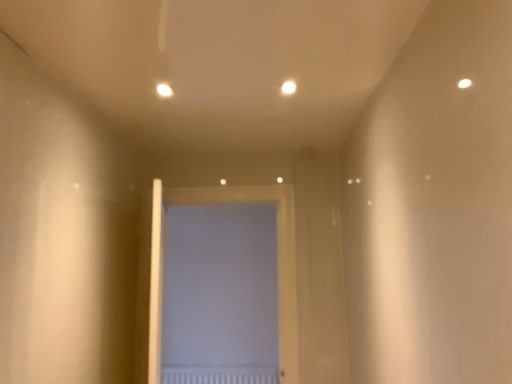
Question: Should I look upward or downward to see matte white light at upper center, acting as the first light starting from the left?

Choices:
 (A) up
 (B) down

Answer: (A)

Question: Which direction should I rotate to look at white glossy light at upper center, acting as the 2th light starting from the left?

Choices:
 (A) right
 (B) left

Answer: (A)

Question: Can you confirm if matte white light at upper center, acting as the first light starting from the left, is smaller than white glossy light at upper center, acting as the 2th light starting from the left?

Choices:
 (A) yes
 (B) no

Answer: (A)

Question: Is matte white light at upper center, acting as the first light starting from the left, closer to camera compared to white glossy light at upper center, acting as the 2th light starting from the left?

Choices:
 (A) yes
 (B) no

Answer: (B)

Question: From the image's perspective, would you say matte white light at upper center, the second light viewed from the right, is positioned over white glossy light at upper center, the 1th light when ordered from right to left?

Choices:
 (A) yes
 (B) no

Answer: (B)

Question: From a real-world perspective, does matte white light at upper center, acting as the first light starting from the left, sit lower than white glossy light at upper center, acting as the 2th light starting from the left?

Choices:
 (A) yes
 (B) no

Answer: (A)

Question: Is matte white light at upper center, acting as the first light starting from the left, positioned far away from white glossy light at upper center, the 1th light when ordered from right to left?

Choices:
 (A) yes
 (B) no

Answer: (B)

Question: Can you confirm if matte white light at upper center, the second light viewed from the right, is wider than white glossy light at upper center, acting as the 2th light starting from the left?

Choices:
 (A) yes
 (B) no

Answer: (A)

Question: Does matte white light at upper center, acting as the first light starting from the left, have a greater width compared to white matte door at center?

Choices:
 (A) no
 (B) yes

Answer: (A)

Question: Does matte white light at upper center, acting as the first light starting from the left, have a lesser height compared to white matte door at center?

Choices:
 (A) no
 (B) yes

Answer: (B)

Question: Is matte white light at upper center, the second light viewed from the right, looking in the opposite direction of white matte door at center?

Choices:
 (A) no
 (B) yes

Answer: (A)

Question: From the image's perspective, would you say matte white light at upper center, the second light viewed from the right, is positioned over white matte door at center?

Choices:
 (A) no
 (B) yes

Answer: (B)

Question: Can you confirm if matte white light at upper center, the second light viewed from the right, is taller than white matte door at center?

Choices:
 (A) no
 (B) yes

Answer: (A)

Question: Is matte white light at upper center, the second light viewed from the right, at the right side of white matte door at center?

Choices:
 (A) yes
 (B) no

Answer: (B)

Question: Considering the relative positions of white matte door at center and white textured radiator at center in the image provided, is white matte door at center to the left of white textured radiator at center from the viewer's perspective?

Choices:
 (A) no
 (B) yes

Answer: (A)